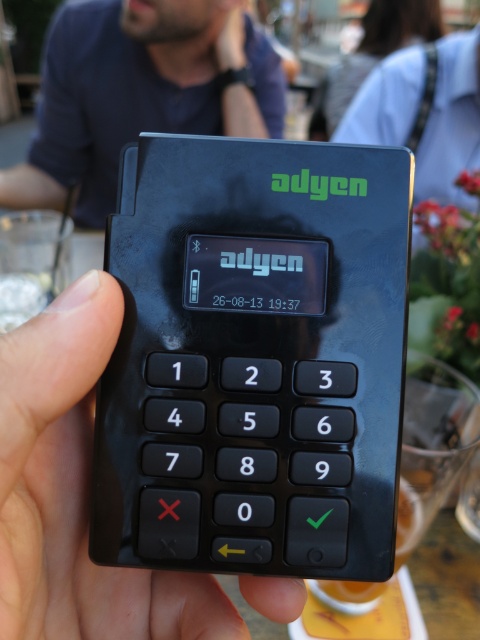
Consider the image. You are a cashier who needs to input a payment amount using the keypad. You have a finger that is 1.5 inches wide. Can you comfortably press the keys on the black plastic keypad at center and the black matte keypad at center without accidentally pressing both at the same time?

The distance between the black plastic keypad at center and black matte keypad at center is 2.31 inches. Since your finger is 1.5 inches wide, there is enough space between them to press each keypad individually without overlapping, so you can comfortably input the payment amount without accidentally pressing both at the same time.

Consider the image. You are a cashier who needs to enter a customer payment. You see the black plastic keypad at center and the dark blue shirt at upper center. Which object is closer to you, the cashier?

The black plastic keypad at center is closer to you than the dark blue shirt at upper center because the keypad is shorter in height compared to the shirt.

You are a cashier trying to locate the keypad on the Adyen terminal. The terminal has two keypads labeled as black plastic keypad at center and black matte keypad at center. Which keypad is on the right side?

The black plastic keypad at center is positioned on the right side of the black matte keypad at center.